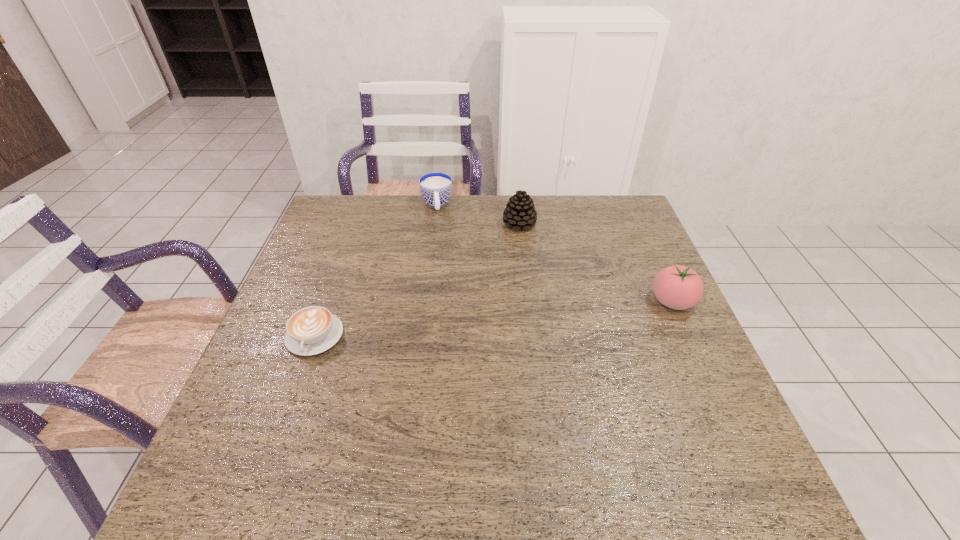
Image resolution: width=960 pixels, height=540 pixels. What are the coordinates of `vacant area that lies between the tomato and the third tallest object` in the screenshot? It's located at [555, 253].

At what (x,y) coordinates should I click in order to perform the action: click on free space between the pinecone and the rightmost object. Please return your answer as a coordinate pair (x, y). Looking at the image, I should click on (596, 262).

You are a GUI agent. You are given a task and a screenshot of the screen. Output one action in this format:
    pyautogui.click(x=<x>, y=<y>)
    Task: Click on the vacant point located between the rightmost object and the shortest object
    
    Given the screenshot: What is the action you would take?
    (493, 319)

Image resolution: width=960 pixels, height=540 pixels. In order to click on vacant space that is in between the shortest object and the tomato in this screenshot , I will do `click(493, 319)`.

Identify which object is the nearest to the shortest object. Please provide its 2D coordinates. Your answer should be formatted as a tuple, i.e. [(x, y)], where the tuple contains the x and y coordinates of a point satisfying the conditions above.

[(435, 187)]

At what (x,y) coordinates should I click in order to perform the action: click on the closest object to the second object from right to left. Please return your answer as a coordinate pair (x, y). Looking at the image, I should click on (435, 187).

At what (x,y) coordinates should I click in order to perform the action: click on vacant position in the image that satisfies the following two spatial constraints: 1. on the front side of the third object from left to right; 2. on the left side of the rightmost object. Please return your answer as a coordinate pair (x, y). The width and height of the screenshot is (960, 540). Looking at the image, I should click on (528, 301).